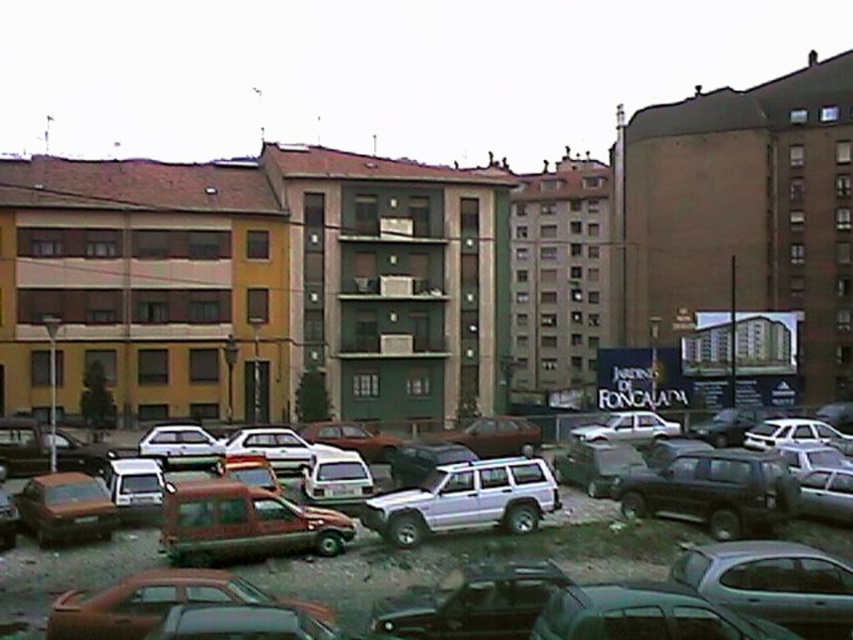
You are driving a car that is 4.5 meters long and want to park between the metallic red van at center and the shiny black suv at center right. Is there enough space between them to park your car?

The metallic red van at center is 10.35 meters from the shiny black suv at center right. Since your car is only 4.5 meters long, there is sufficient space between them to park your car.

You are a delivery driver who needs to park your truck, which is 2 meters tall, in the parking lot. You see the metallic red van at center and the shiny black suv at center right. Which vehicle should you avoid parking next to to ensure there is enough clearance for your truck?

You should avoid parking next to the metallic red van at center because it is much taller than the shiny black suv at center right, so there might be less clearance space available.